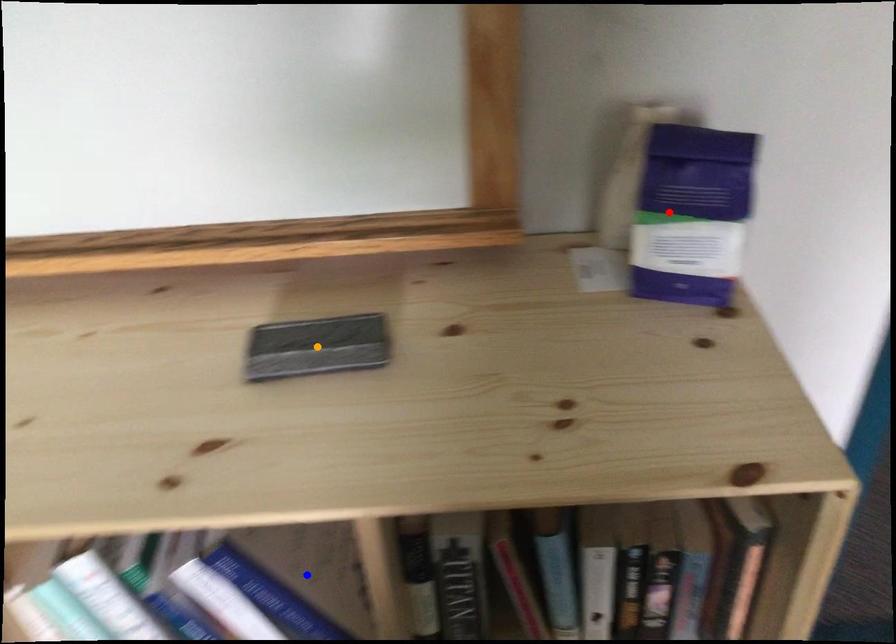
Order these from nearest to farthest:
blue point
red point
orange point

orange point → red point → blue point